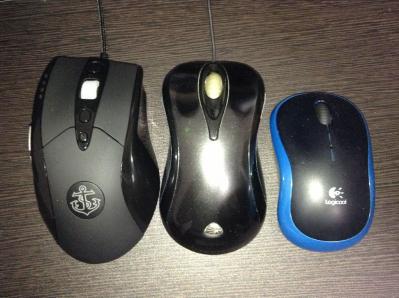
This screenshot has width=399, height=298. I want to click on mouse cords, so click(103, 35), click(212, 36).